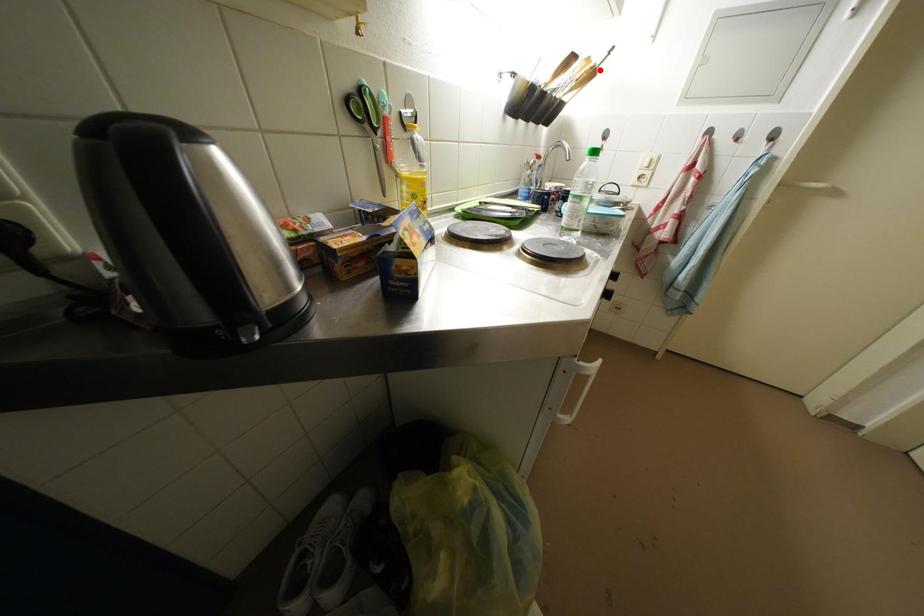
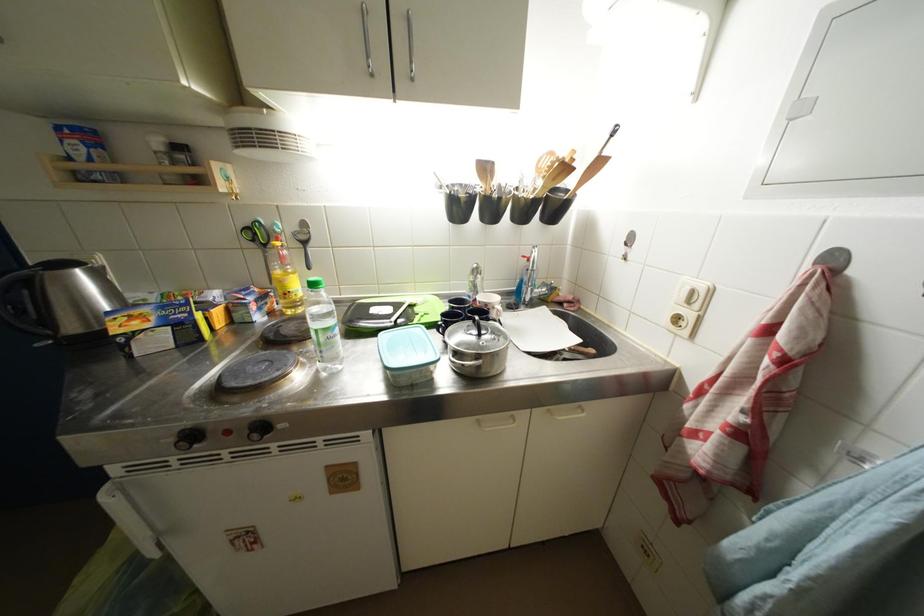
In the second image, find the point that corresponds to the highlighted location in the first image.

(565, 164)